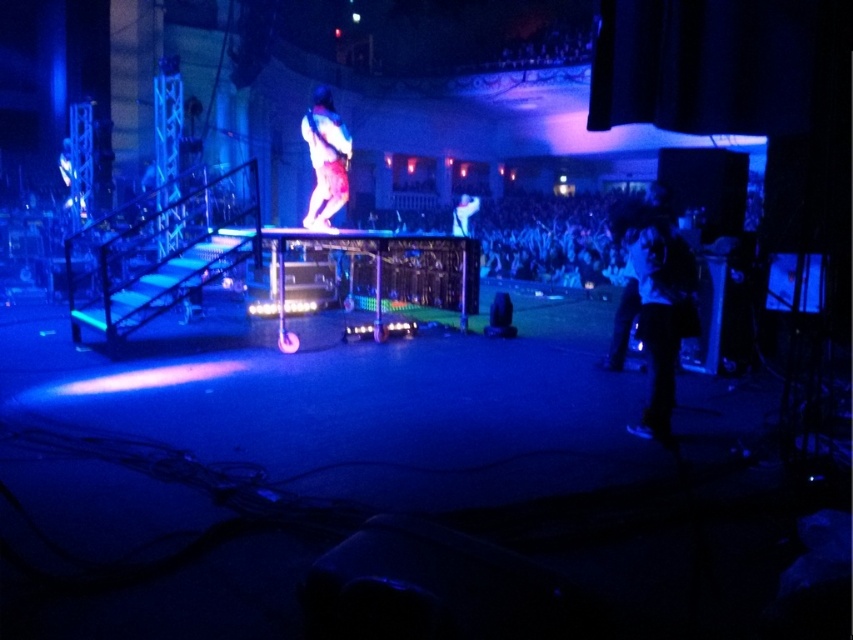
Does shiny metallic guitar at center have a greater width compared to shiny silver guitar at center?

Incorrect, shiny metallic guitar at center's width does not surpass shiny silver guitar at center's.

I want to click on shiny metallic guitar at center, so click(325, 157).

Is black matte jacket at right bigger than shiny silver guitar at center?

No.

Is point (668, 371) closer to viewer compared to point (474, 198)?

Yes, point (668, 371) is in front of point (474, 198).

Between point (624, 330) and point (451, 230), which one is positioned behind?

Point (451, 230)

Locate an element on the screen. The image size is (853, 640). black matte jacket at right is located at coordinates (654, 301).

Can you confirm if black matte jacket at right is shorter than shiny metallic guitar at center?

In fact, black matte jacket at right may be taller than shiny metallic guitar at center.

Which is in front, point (656, 422) or point (329, 92)?

Point (656, 422)

What are the coordinates of `black matte jacket at right` in the screenshot? It's located at (654, 301).